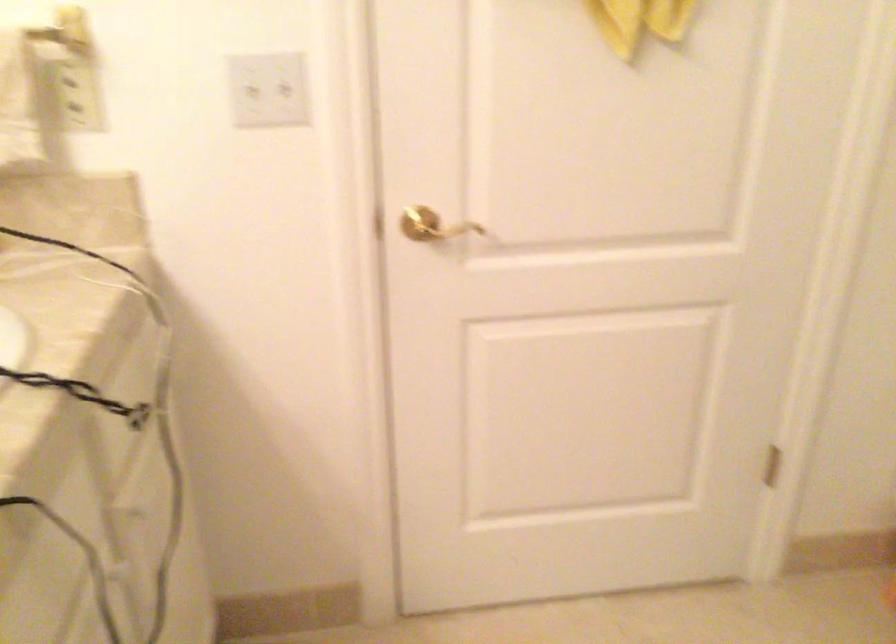
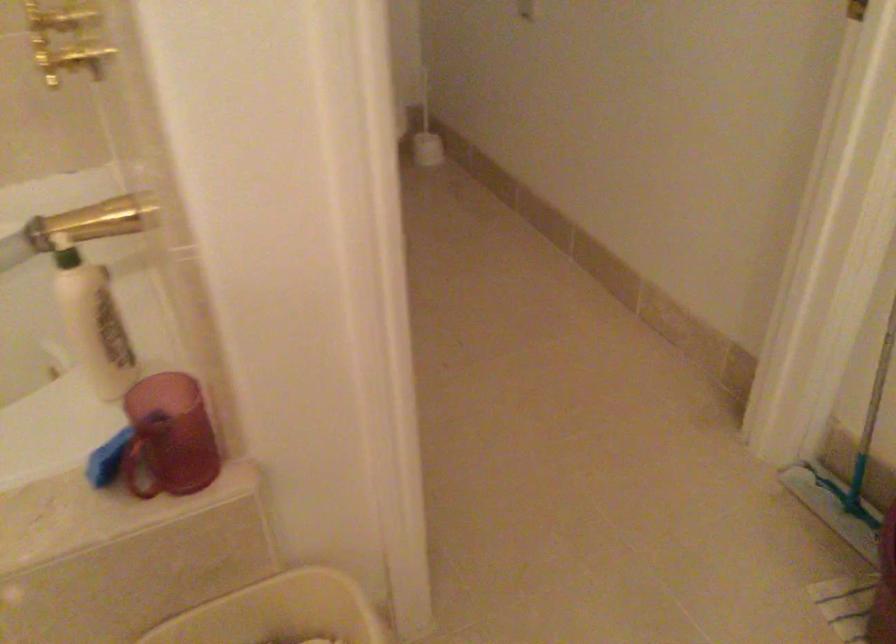
The images are taken continuously from a first-person perspective. In which direction is your viewpoint rotating?

The camera's rotation is toward right-down.